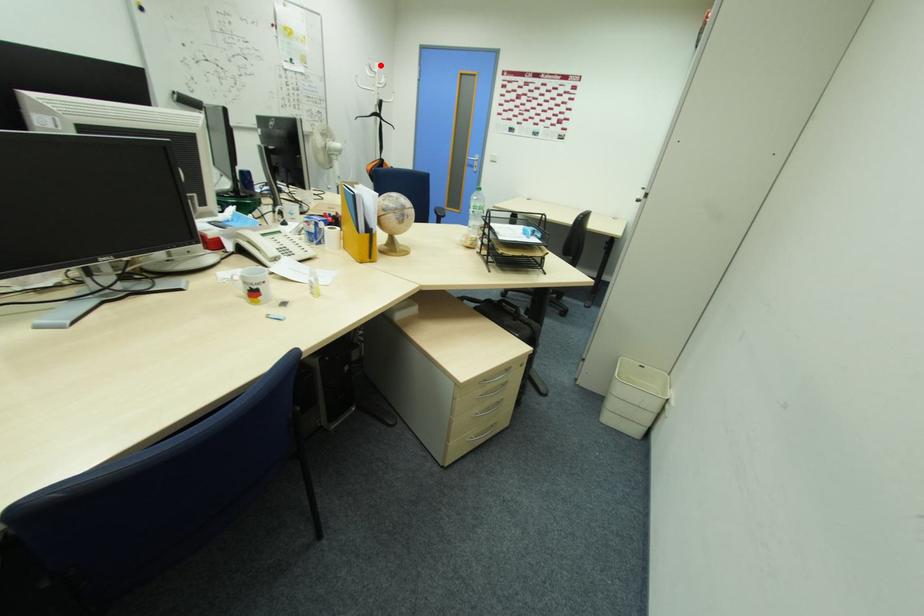
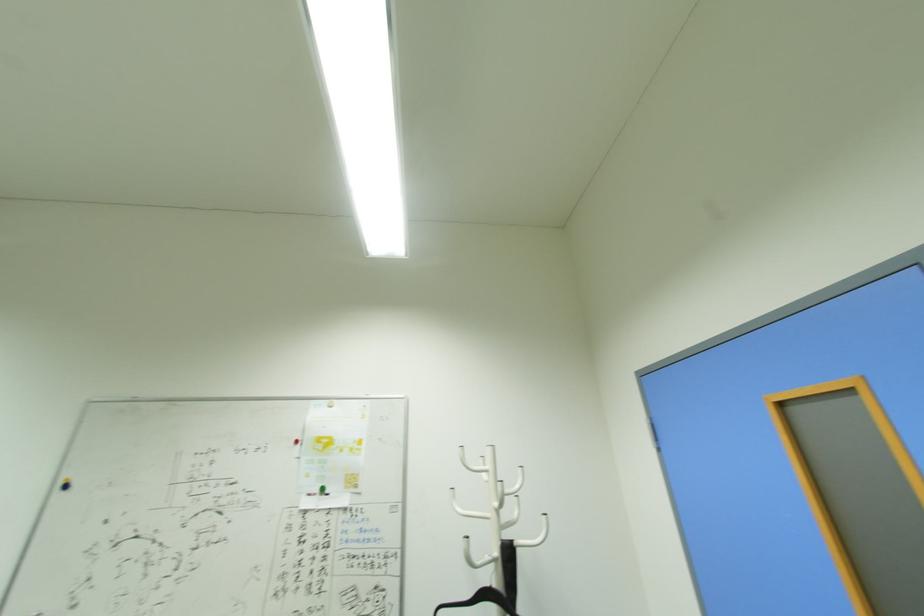
Find the pixel in the second image that matches the highlighted location in the first image.

(493, 451)